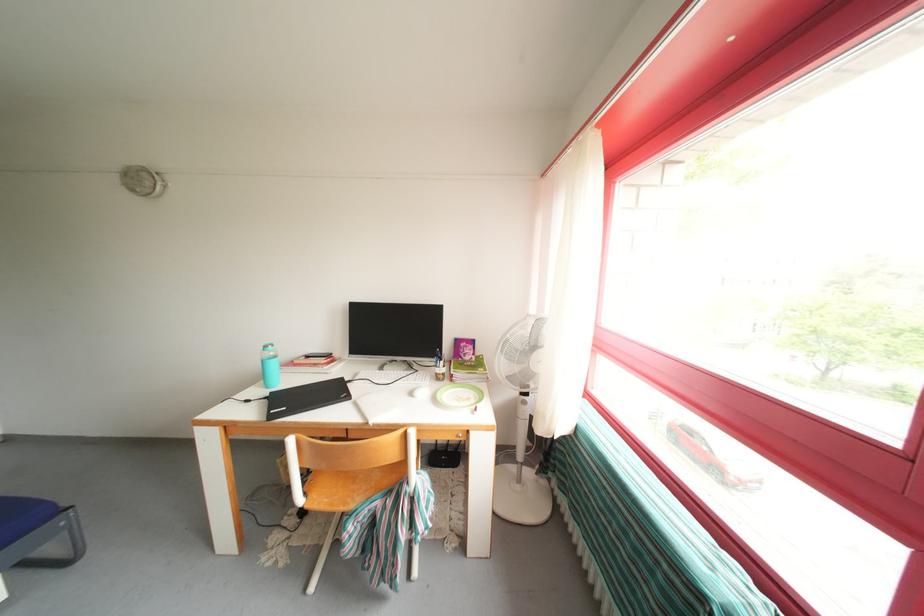
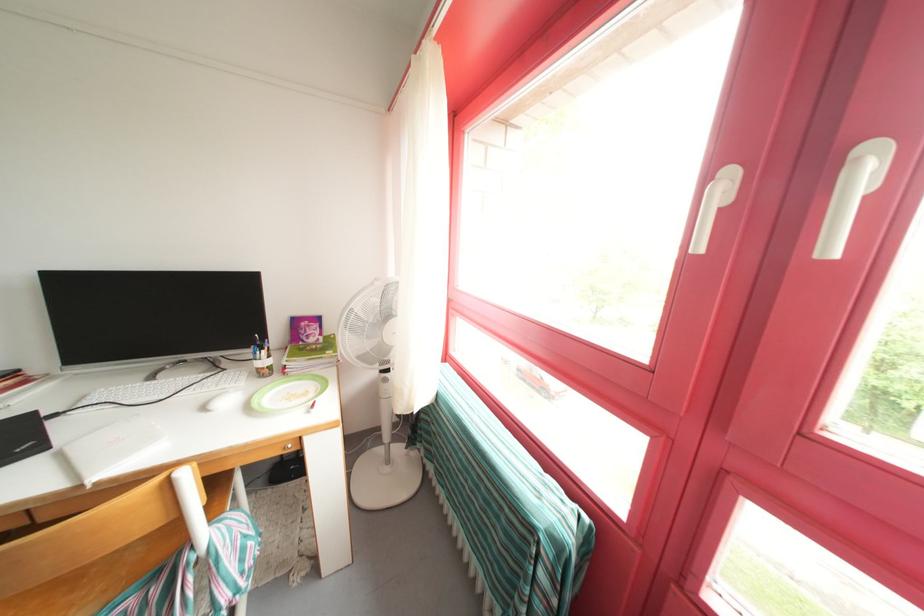
The images are taken continuously from a first-person perspective. In which direction are you moving?

The movement direction of the cameraman is right, forward.